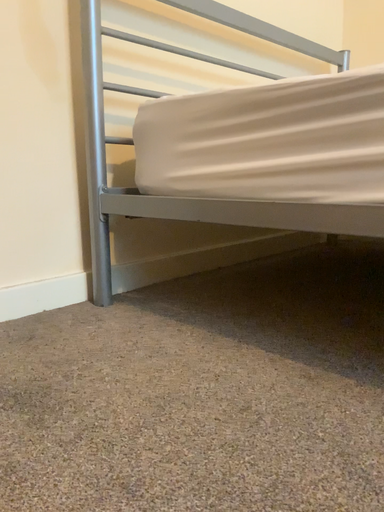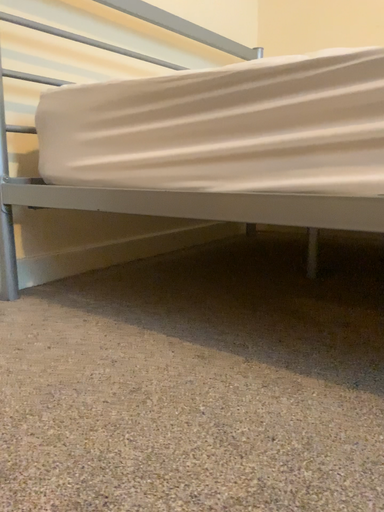
Question: Which way did the camera rotate in the video?

Choices:
 (A) rotated right
 (B) rotated left

Answer: (A)